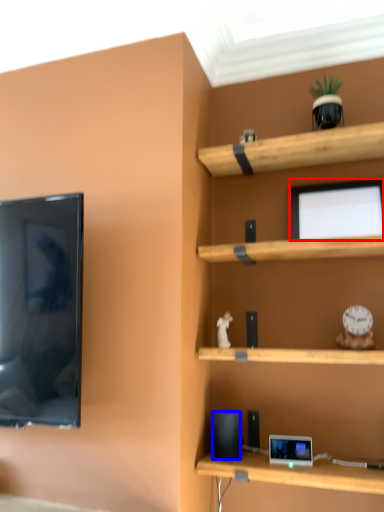
Question: Among these objects, which one is nearest to the camera, computer monitor (highlighted by a red box) or speaker (highlighted by a blue box)?

Choices:
 (A) computer monitor
 (B) speaker

Answer: (B)